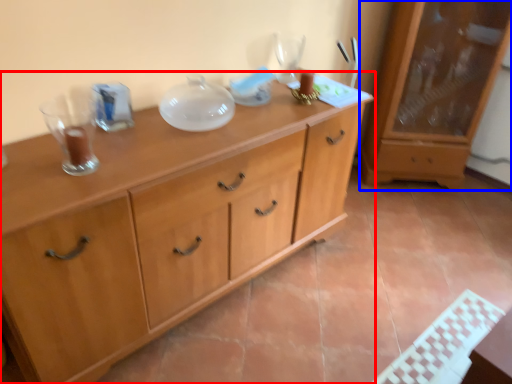
Question: Which of the following is the farthest to the observer, chest of drawers (highlighted by a red box) or cabinetry (highlighted by a blue box)?

Choices:
 (A) chest of drawers
 (B) cabinetry

Answer: (B)